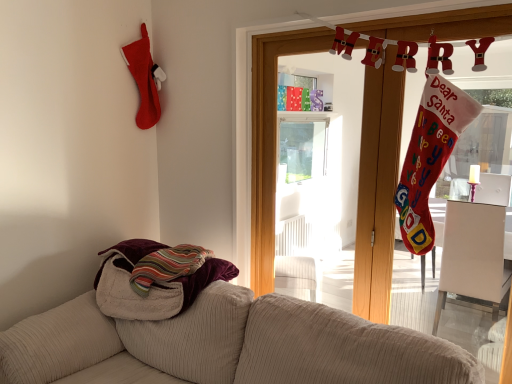
Question: Is wooden door at upper center to the right of beige corduroy couch at lower left from the viewer's perspective?

Choices:
 (A) yes
 (B) no

Answer: (A)

Question: Is wooden door at upper center turned away from beige corduroy couch at lower left?

Choices:
 (A) no
 (B) yes

Answer: (A)

Question: Considering the relative sizes of wooden door at upper center and beige corduroy couch at lower left in the image provided, is wooden door at upper center thinner than beige corduroy couch at lower left?

Choices:
 (A) yes
 (B) no

Answer: (A)

Question: Does wooden door at upper center have a smaller size compared to beige corduroy couch at lower left?

Choices:
 (A) yes
 (B) no

Answer: (A)

Question: Is wooden door at upper center surrounding beige corduroy couch at lower left?

Choices:
 (A) yes
 (B) no

Answer: (B)

Question: From the image's perspective, is wooden door at upper center positioned above or below beige corduroy couch at lower left?

Choices:
 (A) below
 (B) above

Answer: (B)

Question: Is wooden door at upper center in front of or behind beige corduroy couch at lower left in the image?

Choices:
 (A) front
 (B) behind

Answer: (B)

Question: Considering the positions of point (490, 34) and point (329, 329), is point (490, 34) closer or farther from the camera than point (329, 329)?

Choices:
 (A) closer
 (B) farther

Answer: (A)

Question: Choose the correct answer: Is wooden door at upper center inside beige corduroy couch at lower left or outside it?

Choices:
 (A) inside
 (B) outside

Answer: (B)

Question: Does point (118, 259) appear closer or farther from the camera than point (380, 180)?

Choices:
 (A) farther
 (B) closer

Answer: (A)

Question: In terms of height, does striped cotton towel at lower left look taller or shorter compared to wooden door at upper center?

Choices:
 (A) tall
 (B) short

Answer: (B)

Question: In terms of size, does striped cotton towel at lower left appear bigger or smaller than wooden door at upper center?

Choices:
 (A) small
 (B) big

Answer: (B)

Question: Considering the relative positions of striped cotton towel at lower left and wooden door at upper center in the image provided, is striped cotton towel at lower left to the left or to the right of wooden door at upper center?

Choices:
 (A) left
 (B) right

Answer: (A)

Question: From their relative heights in the image, would you say striped cotton towel at lower left is taller or shorter than beige corduroy couch at lower left?

Choices:
 (A) short
 (B) tall

Answer: (A)

Question: Considering their positions, is striped cotton towel at lower left located in front of or behind beige corduroy couch at lower left?

Choices:
 (A) front
 (B) behind

Answer: (B)